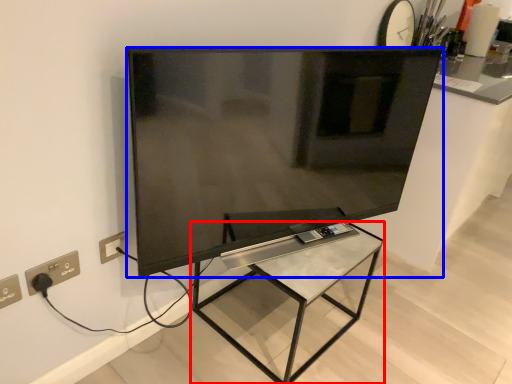
Question: Which object is closer to the camera taking this photo, furniture (highlighted by a red box) or television (highlighted by a blue box)?

Choices:
 (A) furniture
 (B) television

Answer: (B)